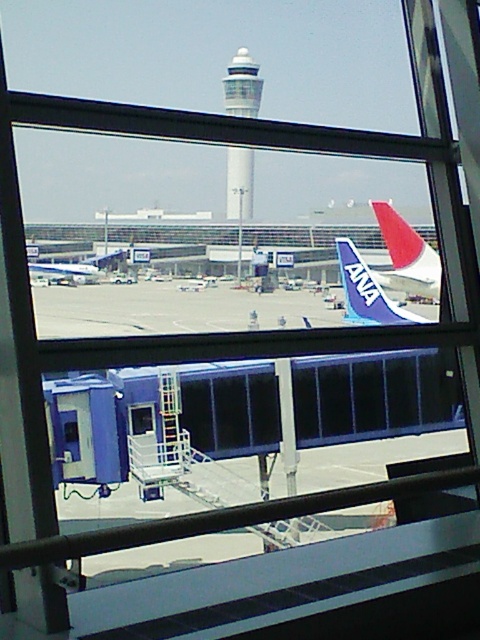
Question: Among these objects, which one is nearest to the camera?

Choices:
 (A) blue fabric airplane tail at right
 (B) light gray concrete control tower at upper center
 (C) gray concrete tarmac at center
 (D) matte red and white tail at upper right

Answer: (C)

Question: Considering the real-world distances, which object is farthest from the light gray concrete control tower at upper center?

Choices:
 (A) matte red and white tail at upper right
 (B) blue metallic airplane at center
 (C) gray concrete tarmac at center

Answer: (A)

Question: Can you confirm if gray concrete tarmac at center is positioned below matte red and white tail at upper right?

Choices:
 (A) no
 (B) yes

Answer: (B)

Question: Is the position of gray concrete tarmac at center more distant than that of blue metallic airplane at center?

Choices:
 (A) yes
 (B) no

Answer: (B)

Question: In this image, where is gray concrete tarmac at center located relative to light gray concrete control tower at upper center?

Choices:
 (A) below
 (B) above

Answer: (A)

Question: Which point is closer to the camera?

Choices:
 (A) blue fabric airplane tail at right
 (B) light gray concrete control tower at upper center
 (C) gray concrete tarmac at center

Answer: (C)